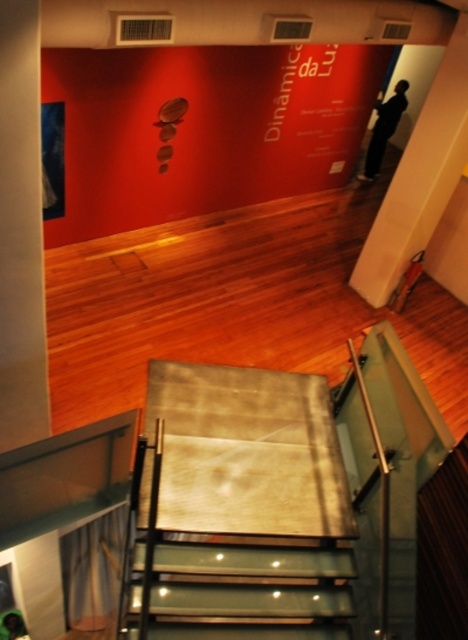
Is point (380, 148) behind point (13, 612)?

Yes.

Who is more forward, (396, 104) or (20, 625)?

Point (20, 625)

Locate an element on the screen. The height and width of the screenshot is (640, 468). black matte pants at upper right is located at coordinates (384, 129).

Where is `black matte pants at upper right`? The height and width of the screenshot is (640, 468). black matte pants at upper right is located at coordinates (384, 129).

Who is positioned more to the right, clear glass stairs at center or green fabric person at lower left?

clear glass stairs at center is more to the right.

Where is `clear glass stairs at center`? The width and height of the screenshot is (468, 640). clear glass stairs at center is located at coordinates (250, 589).

Which is in front, point (317, 584) or point (9, 612)?

Point (317, 584) is in front.

This screenshot has width=468, height=640. What are the coordinates of `clear glass stairs at center` in the screenshot? It's located at (250, 589).

Locate an element on the screen. clear glass stairs at center is located at coordinates (250, 589).

Is clear glass stairs at center below black matte pants at upper right?

Correct, clear glass stairs at center is located below black matte pants at upper right.

Does point (333, 616) come farther from viewer compared to point (365, 154)?

No, (333, 616) is closer to viewer.

Locate an element on the screen. The height and width of the screenshot is (640, 468). clear glass stairs at center is located at coordinates (250, 589).